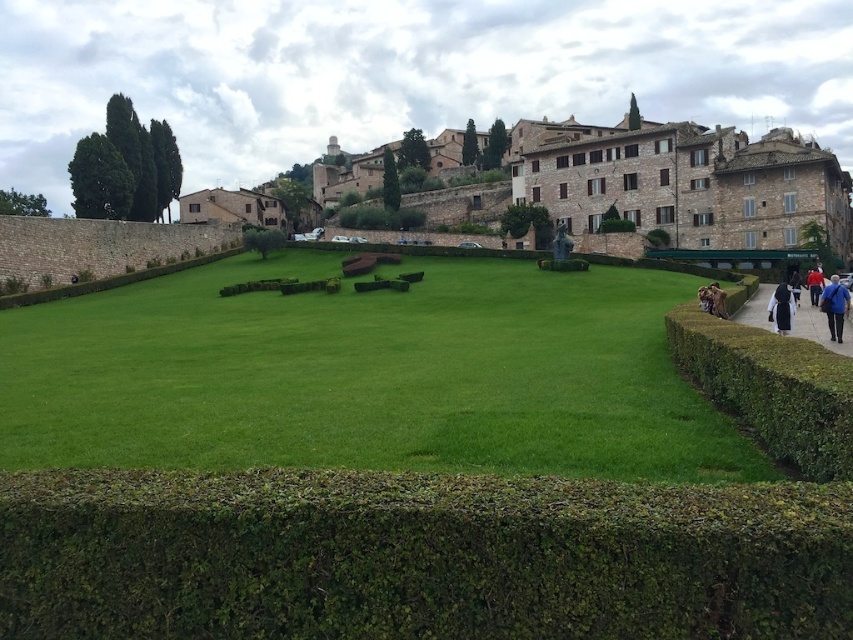
Question: Which point is farther to the camera?

Choices:
 (A) brown paved path at lower right
 (B) black cloth at lower right
 (C) blue fabric jacket at lower right

Answer: (C)

Question: Does green leafy hedge at lower center have a greater width compared to black cloth at lower right?

Choices:
 (A) no
 (B) yes

Answer: (B)

Question: Is green grass at center bigger than green leafy hedge at right?

Choices:
 (A) yes
 (B) no

Answer: (A)

Question: Estimate the real-world distances between objects in this image. Which object is closer to the brown paved path at lower right?

Choices:
 (A) black cloth at lower right
 (B) green leafy hedge at lower center
 (C) blue fabric bag at lower right
 (D) green grass at center

Answer: (A)

Question: Which object is farther from the camera taking this photo?

Choices:
 (A) blue fabric jacket at lower right
 (B) green leafy hedge at lower center
 (C) brown paved path at lower right
 (D) brown leather jacket at right

Answer: (A)

Question: Can you confirm if green grass at center is positioned above blue fabric jacket at lower right?

Choices:
 (A) no
 (B) yes

Answer: (A)